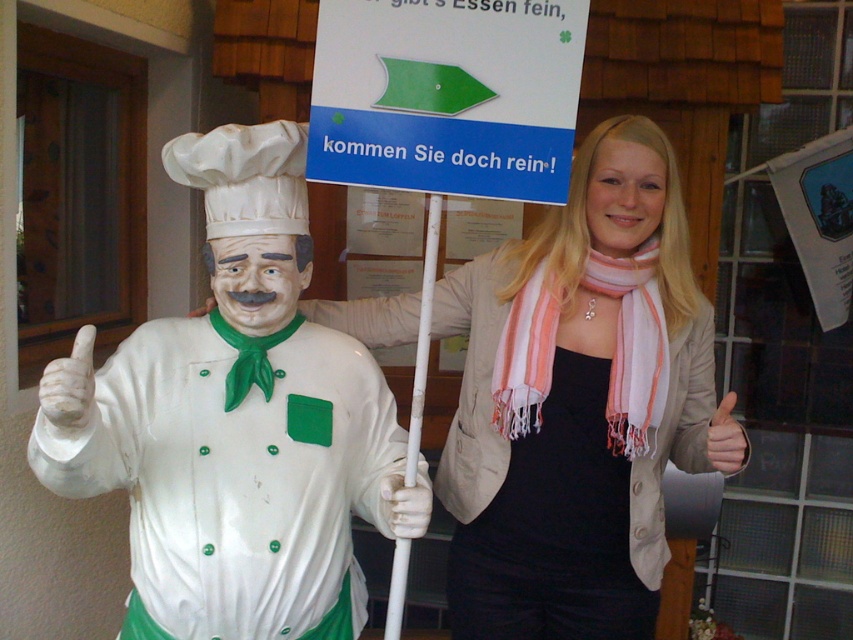
Question: Which of the following is the closest to the observer?

Choices:
 (A) matte beige jacket at center
 (B) white glossy statue at left

Answer: (B)

Question: Based on their relative distances, which object is farther from the white plastic sign at upper center?

Choices:
 (A) white glossy statue at left
 (B) white plastic pole at center

Answer: (A)

Question: Does matte beige jacket at center have a smaller size compared to white plastic pole at center?

Choices:
 (A) no
 (B) yes

Answer: (A)

Question: Does white glossy statue at left have a smaller size compared to white plastic sign at upper center?

Choices:
 (A) no
 (B) yes

Answer: (A)

Question: Which of the following is the farthest from the observer?

Choices:
 (A) (184, 368)
 (B) (461, 624)
 (C) (601, 609)

Answer: (B)

Question: From the image, what is the correct spatial relationship of white glossy statue at left in relation to matte beige jacket at center?

Choices:
 (A) below
 (B) above

Answer: (A)